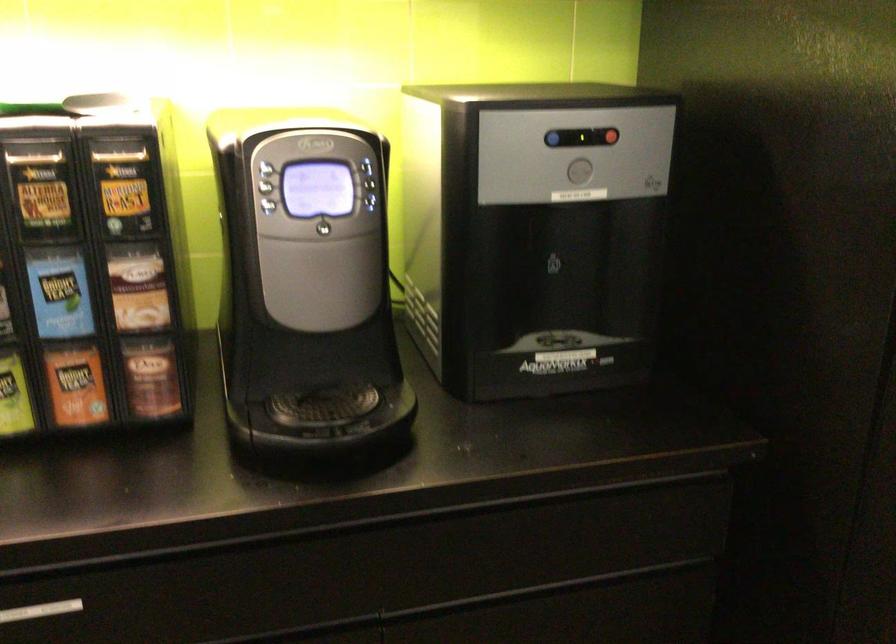
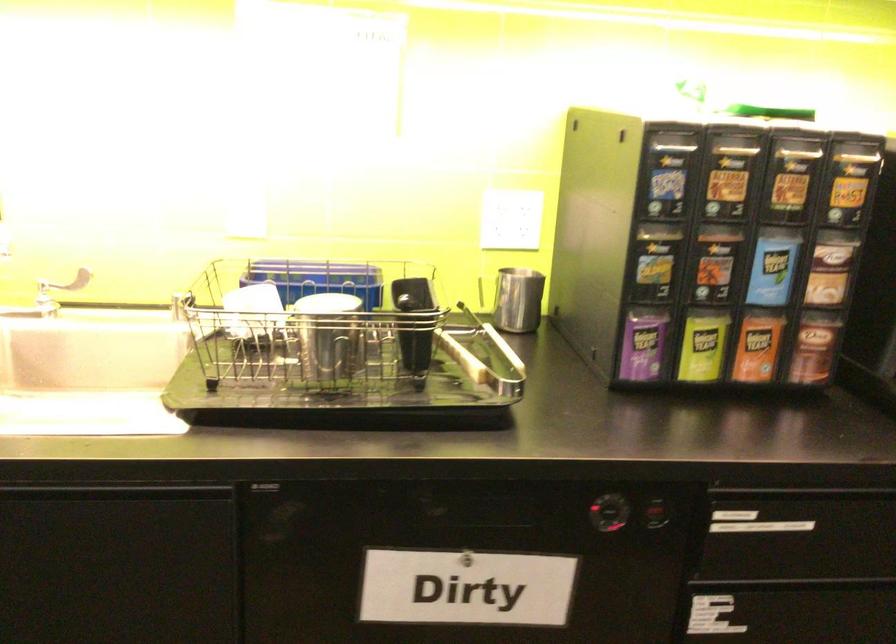
Question: The camera is either moving clockwise (left) or counter-clockwise (right) around the object. The first image is from the beginning of the video and the second image is from the end. Is the camera moving left or right when shooting the video?

Choices:
 (A) Left
 (B) Right

Answer: (B)